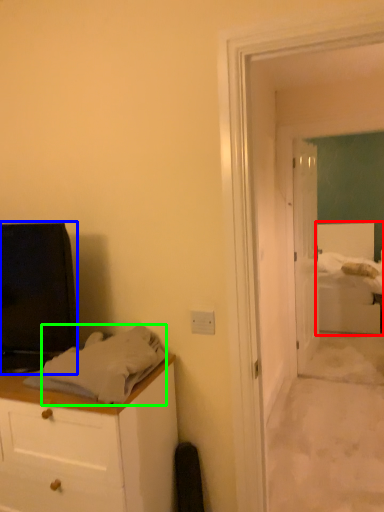
Question: Estimate the real-world distances between objects in this image. Which object is farther from bed (highlighted by a red box), television (highlighted by a blue box) or sheet (highlighted by a green box)?

Choices:
 (A) television
 (B) sheet

Answer: (A)